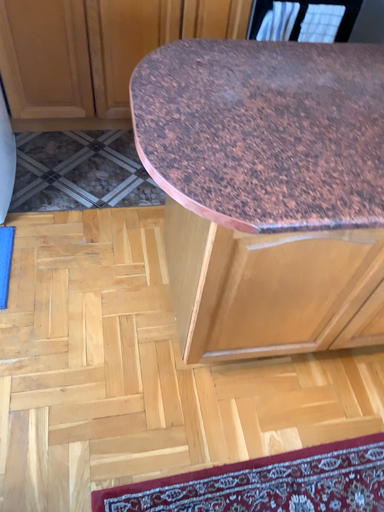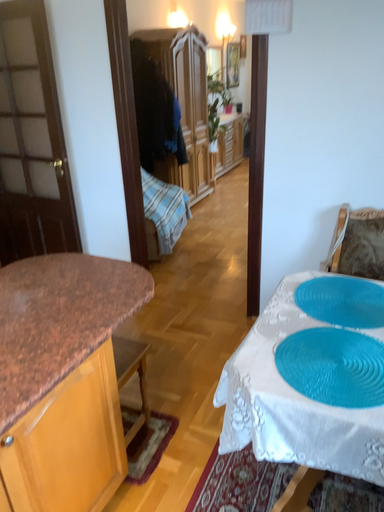
Question: How did the camera likely rotate when shooting the video?

Choices:
 (A) rotated upward
 (B) rotated downward

Answer: (A)